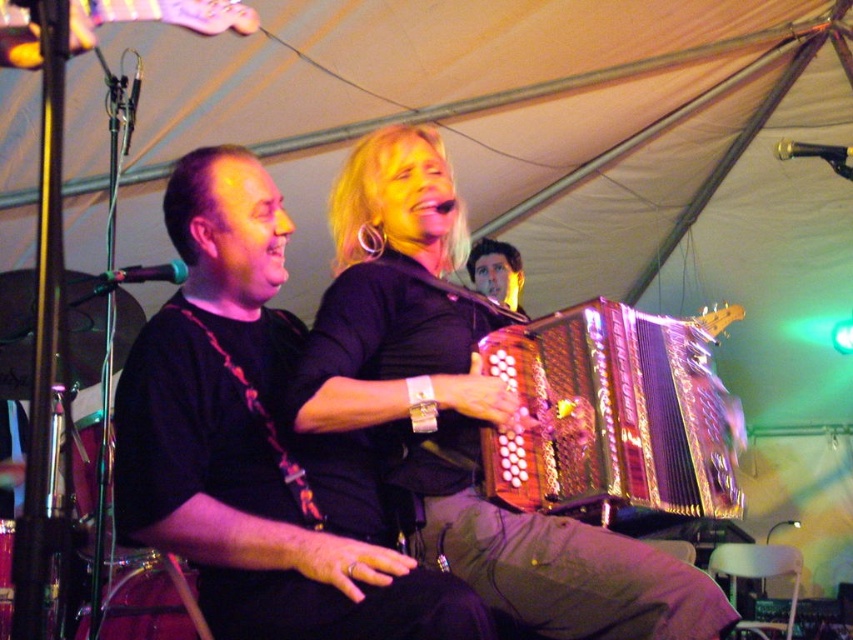
You are a photographer at the event and want to capture a photo that includes both the gold metallic accordion at center and the shiny black hair at upper center. Based on their sizes in the image, which object should you focus on first to ensure both are in frame?

The gold metallic accordion at center is taller than the shiny black hair at upper center, so focusing on the gold metallic accordion at center first will ensure both are in frame as it takes up more space.

You are a photographer trying to capture the accordion and the guitar in the same frame. Given that the metallic pink guitar at upper left is behind the metallic gold accordion at center, will you need to adjust your camera angle to see both objects clearly?

Yes, since the metallic pink guitar at upper left is behind the metallic gold accordion at center, you will need to adjust your camera angle to ensure both are visible in the frame.

You are a photographer at the event and want to capture a clear photo of both the metallic gold accordion at center and the black fabric shirt at center. Which object should you adjust your focus on first to ensure both are in the frame?

The black fabric shirt at center is behind the metallic gold accordion at center, so you should focus on the metallic gold accordion at center first to ensure both are in the frame.